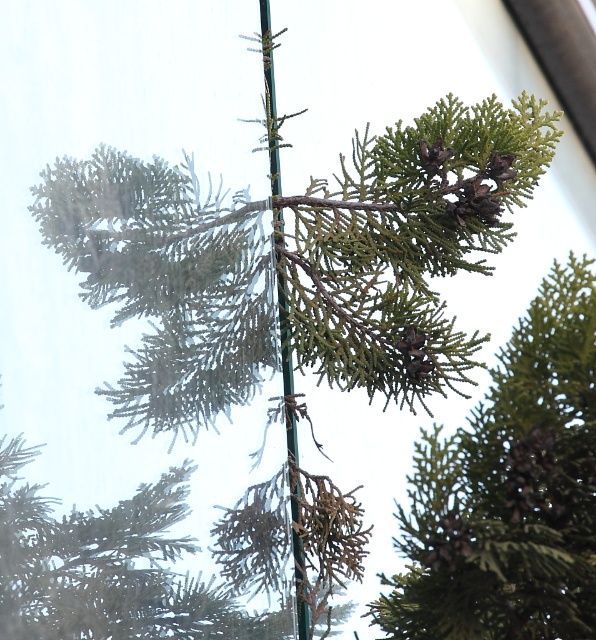
Question: Does green matte pine cone at center appear on the left side of green metallic pole at center?

Choices:
 (A) no
 (B) yes

Answer: (A)

Question: Which object is farther from the camera taking this photo?

Choices:
 (A) green metallic pole at center
 (B) green matte pine cone at center

Answer: (A)

Question: Does green matte pine cone at center have a larger size compared to green metallic pole at center?

Choices:
 (A) no
 (B) yes

Answer: (B)

Question: Does green matte pine cone at center have a lesser width compared to green metallic pole at center?

Choices:
 (A) no
 (B) yes

Answer: (A)

Question: Which object appears closest to the camera in this image?

Choices:
 (A) green matte pine cone at center
 (B) green metallic pole at center

Answer: (A)